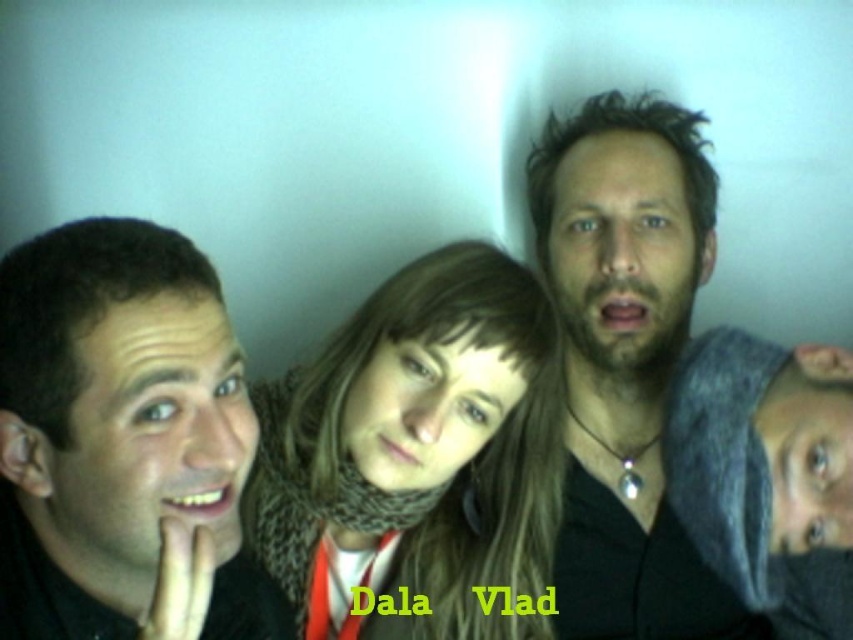
Is black matte face at left to the right of matte black shirt at center from the viewer's perspective?

In fact, black matte face at left is to the left of matte black shirt at center.

Does black matte face at left have a lesser height compared to matte black shirt at center?

Yes, black matte face at left is shorter than matte black shirt at center.

The image size is (853, 640). Find the location of `black matte face at left`. black matte face at left is located at coordinates (123, 444).

Does black matte face at left come behind knitted scarf at center?

No, black matte face at left is closer to the viewer.

Identify the location of black matte face at left. (123, 444).

Where is `black matte face at left`? black matte face at left is located at coordinates (123, 444).

Does point (396, 301) come in front of point (628, 195)?

Yes, point (396, 301) is closer to viewer.

Who is lower down, knitted scarf at center or matte black shirt at center?

Positioned lower is knitted scarf at center.

Identify the location of knitted scarf at center. This screenshot has height=640, width=853. (416, 456).